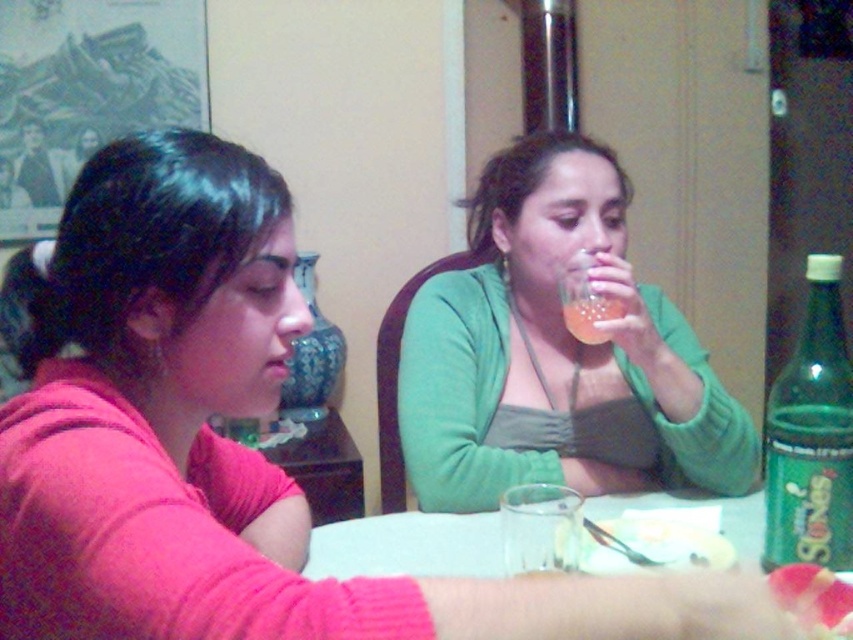
Looking at this image, which of these two, green glass bottle at right or pink glossy flower at upper center, stands taller?

green glass bottle at right

Does green glass bottle at right appear on the left side of pink glossy flower at upper center?

No, green glass bottle at right is not to the left of pink glossy flower at upper center.

Does point (786, 410) come farther from viewer compared to point (791, 577)?

That is True.

You are a GUI agent. You are given a task and a screenshot of the screen. Output one action in this format:
    pyautogui.click(x=<x>, y=<y>)
    Task: Click on the green glass bottle at right
    The width and height of the screenshot is (853, 640).
    Given the screenshot: What is the action you would take?
    pyautogui.click(x=811, y=435)

Does green textured sweater at upper right have a greater width compared to translucent plastic cup at upper center?

Yes, green textured sweater at upper right is wider than translucent plastic cup at upper center.

Which is more to the right, green textured sweater at upper right or translucent plastic cup at upper center?

From the viewer's perspective, translucent plastic cup at upper center appears more on the right side.

Between point (602, 400) and point (598, 296), which one is positioned in front?

Positioned in front is point (598, 296).

What are the coordinates of `green textured sweater at upper right` in the screenshot? It's located at click(x=556, y=353).

Is the position of green textured sweater at upper right less distant than that of green glass bottle at right?

No.

Is green textured sweater at upper right further to the viewer compared to green glass bottle at right?

Yes, green textured sweater at upper right is further from the viewer.

Who is more forward, (639, 376) or (822, 406)?

Positioned in front is point (822, 406).

Locate an element on the screen. This screenshot has height=640, width=853. green textured sweater at upper right is located at coordinates click(x=556, y=353).